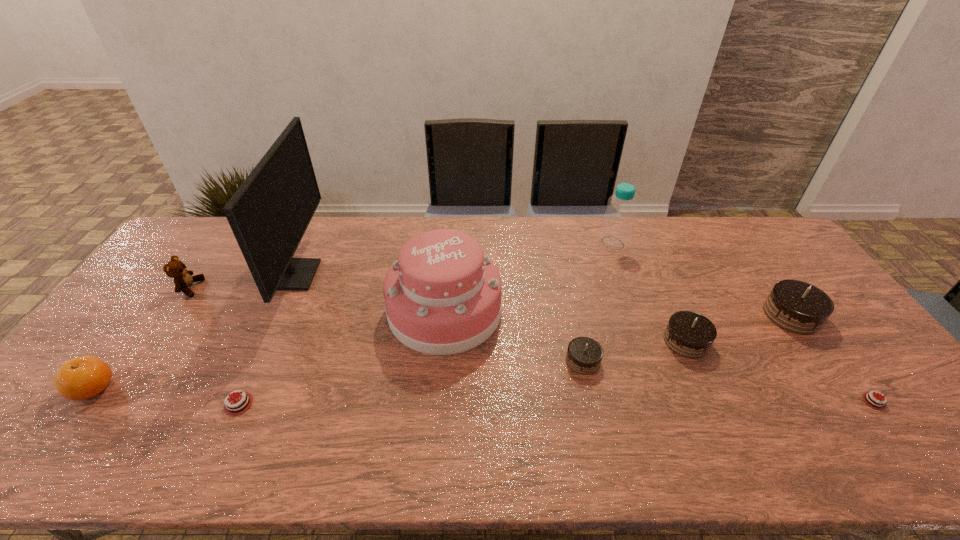
The height and width of the screenshot is (540, 960). I want to click on object that can be found as the sixth closest to the tallest object, so (617, 224).

At what (x,y) coordinates should I click in order to perform the action: click on object that can be found as the closest to the bottle. Please return your answer as a coordinate pair (x, y). Image resolution: width=960 pixels, height=540 pixels. Looking at the image, I should click on (689, 334).

You are a GUI agent. You are given a task and a screenshot of the screen. Output one action in this format:
    pyautogui.click(x=<x>, y=<y>)
    Task: Click on the chocolate cake that stands as the fifth closest to the birthday cake
    This screenshot has height=540, width=960.
    Given the screenshot: What is the action you would take?
    pyautogui.click(x=870, y=398)

Select which chocolate cake appears as the closest to the smallest chocolate chocolate cake. Please provide its 2D coordinates. Your answer should be formatted as a tuple, i.e. [(x, y)], where the tuple contains the x and y coordinates of a point satisfying the conditions above.

[(689, 334)]

Find the location of a particular element. The width and height of the screenshot is (960, 540). chocolate chocolate cake that stands as the closest to the teddy bear is located at coordinates (584, 355).

Locate which chocolate chocolate cake ranks third in proximity to the birthday cake. Please provide its 2D coordinates. Your answer should be formatted as a tuple, i.e. [(x, y)], where the tuple contains the x and y coordinates of a point satisfying the conditions above.

[(796, 306)]

What are the coordinates of `vacant space that satisfies the following two spatial constraints: 1. on the back side of the ninth tallest object; 2. on the front-facing side of the teddy bear` in the screenshot? It's located at (292, 288).

You are a GUI agent. You are given a task and a screenshot of the screen. Output one action in this format:
    pyautogui.click(x=<x>, y=<y>)
    Task: Click on the vacant region that satisfies the following two spatial constraints: 1. on the front-facing side of the computer monitor; 2. on the back side of the tallest chocolate cake
    
    Given the screenshot: What is the action you would take?
    pyautogui.click(x=277, y=315)

Image resolution: width=960 pixels, height=540 pixels. In order to click on free location that satisfies the following two spatial constraints: 1. on the front-facing side of the brown teddy bear; 2. on the back side of the leftmost chocolate chocolate cake in this screenshot , I will do `click(138, 361)`.

Image resolution: width=960 pixels, height=540 pixels. Find the location of `free spot that satisfies the following two spatial constraints: 1. on the back side of the birthday cake; 2. on the front-facing side of the brown teddy bear`. free spot that satisfies the following two spatial constraints: 1. on the back side of the birthday cake; 2. on the front-facing side of the brown teddy bear is located at coordinates (446, 288).